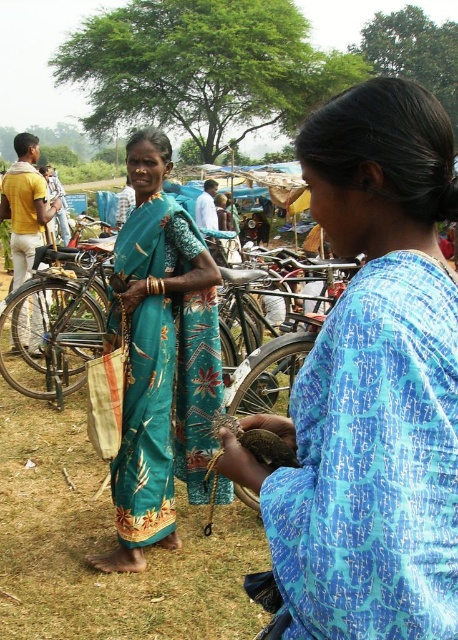
What is located at the coordinates point (371,385) in the image?

The blue printed dress at center is located at point (371,385).

You are a photographer at the market and want to capture both the metallic silver bicycle at left and the yellow cotton shirt at left in the same frame. Which object should you position closer to the center of your camera viewfinder to include both?

To include both the metallic silver bicycle at left and the yellow cotton shirt at left in the same frame, position the metallic silver bicycle at left closer to the center since it is already to the right of the yellow cotton shirt at left, meaning it is farther from the left edge and closer to the center by default.